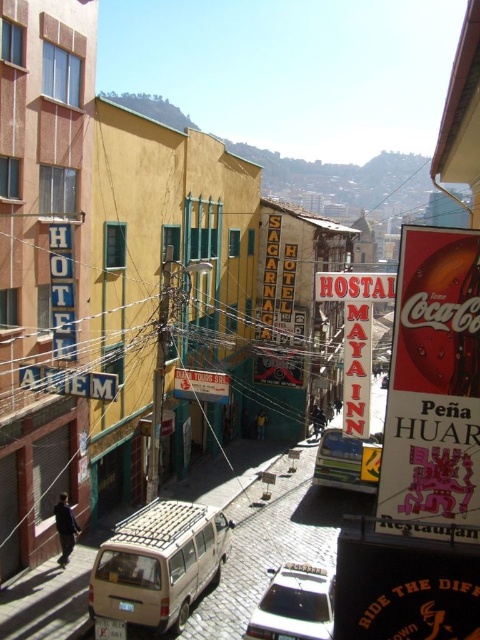
You are standing on the street and want to take a photo of the point at coordinates point (479,244). Your camera has a focal length of 24mm and you want to ensure the point is in focus. What is the minimum distance in feet you need to be from the point to capture it clearly?

The point at coordinates point (479,244) is 22.34 feet away from the viewer. To ensure it is in focus, you need to be at least 22.34 feet away from the point.